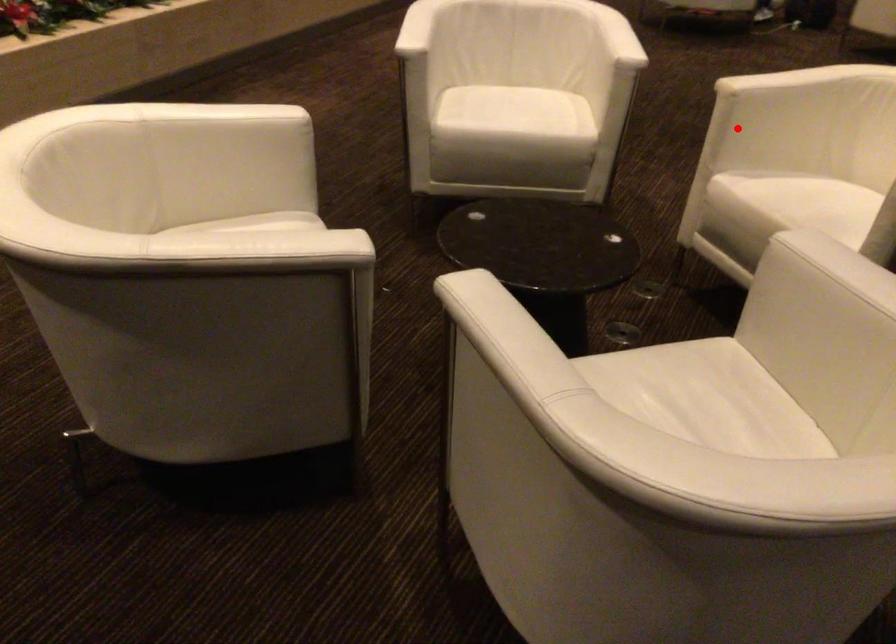
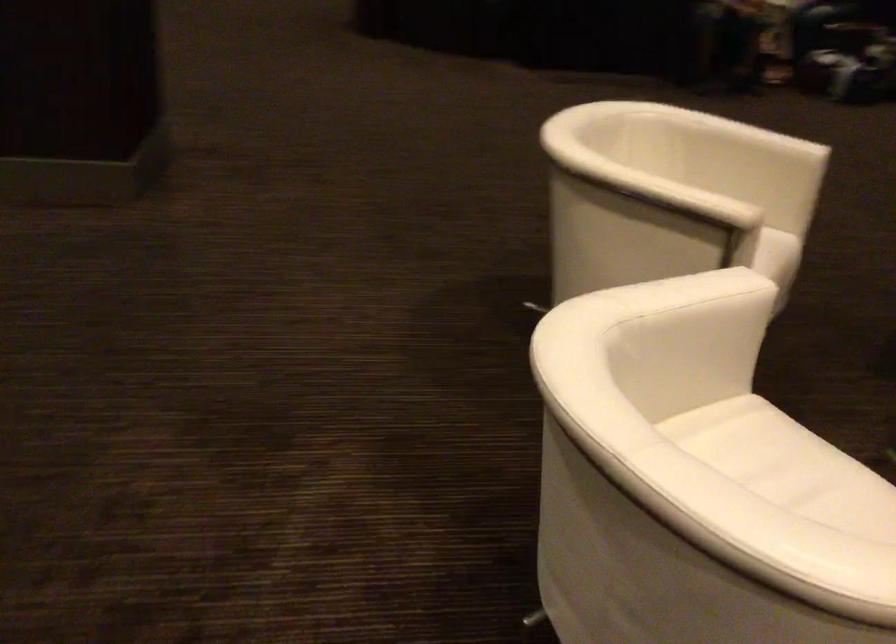
Question: I am providing you with two images of the same scene from different viewpoints. Given a red point in image1, look at the same physical point in image2. Is it:

Choices:
 (A) Closer to the viewpoint
 (B) Farther from the viewpoint

Answer: (A)